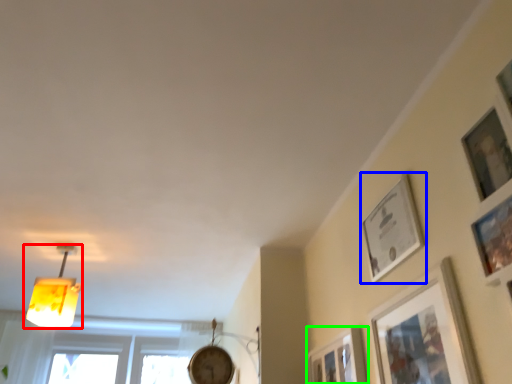
Question: Which object is positioned farthest from lamp (highlighted by a red box)? Select from picture frame (highlighted by a blue box) and picture frame (highlighted by a green box).

Choices:
 (A) picture frame
 (B) picture frame

Answer: (A)